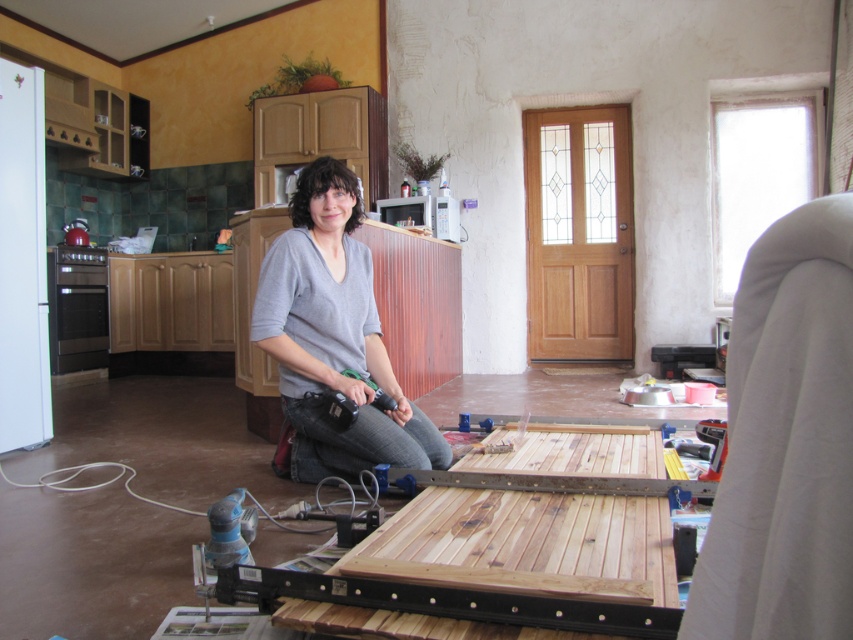
Question: Does white fabric armchair at right have a greater width compared to gray cotton shirt at center?

Choices:
 (A) yes
 (B) no

Answer: (B)

Question: Which point is closer to the camera?

Choices:
 (A) white fabric armchair at right
 (B) gray cotton shirt at center

Answer: (A)

Question: Can you confirm if white fabric armchair at right is thinner than gray cotton shirt at center?

Choices:
 (A) no
 (B) yes

Answer: (B)

Question: Among these points, which one is nearest to the camera?

Choices:
 (A) (752, 433)
 (B) (351, 252)

Answer: (A)

Question: Does white fabric armchair at right come behind gray cotton shirt at center?

Choices:
 (A) yes
 (B) no

Answer: (B)